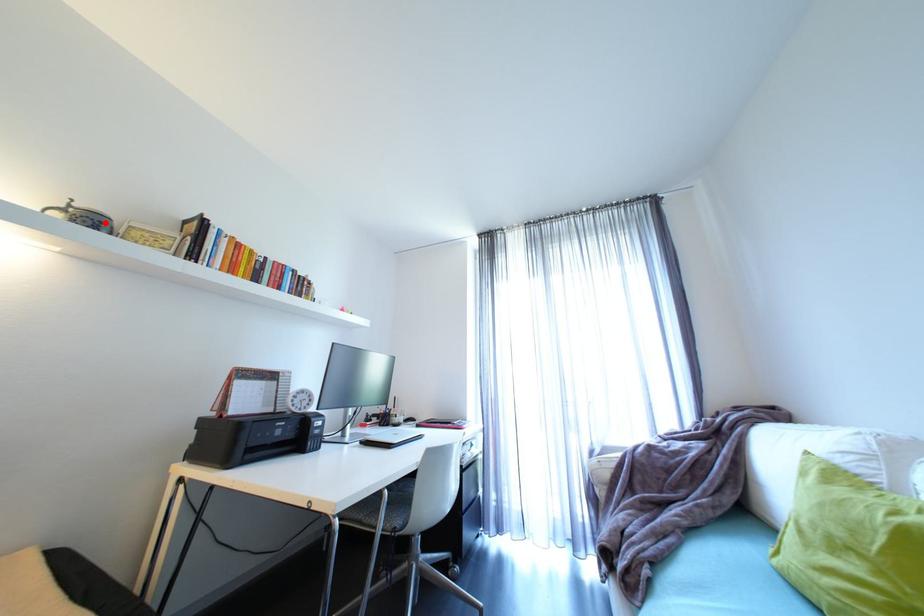
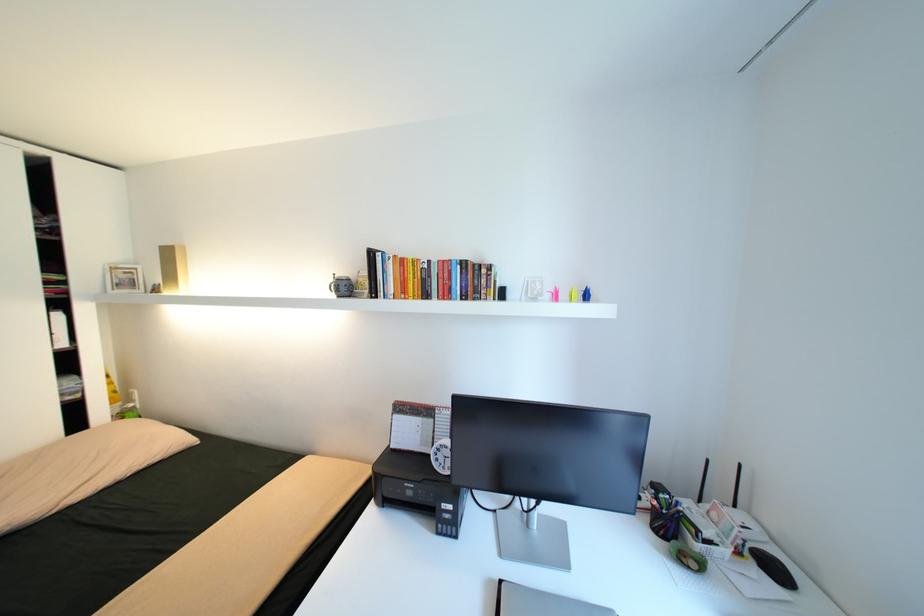
Locate, in the second image, the point that corresponds to the highlighted location in the first image.

(344, 286)